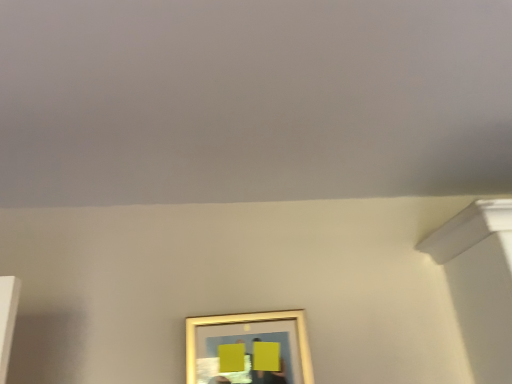
The width and height of the screenshot is (512, 384). What are the coordinates of `gold metallic picture frame at center` in the screenshot? It's located at (248, 349).

What do you see at coordinates (248, 349) in the screenshot? This screenshot has width=512, height=384. I see `gold metallic picture frame at center` at bounding box center [248, 349].

In order to face gold metallic picture frame at center, should I rotate leftwards or rightwards?

To align with it, rotate left about 0.681°.

The width and height of the screenshot is (512, 384). Identify the location of gold metallic picture frame at center. (248, 349).